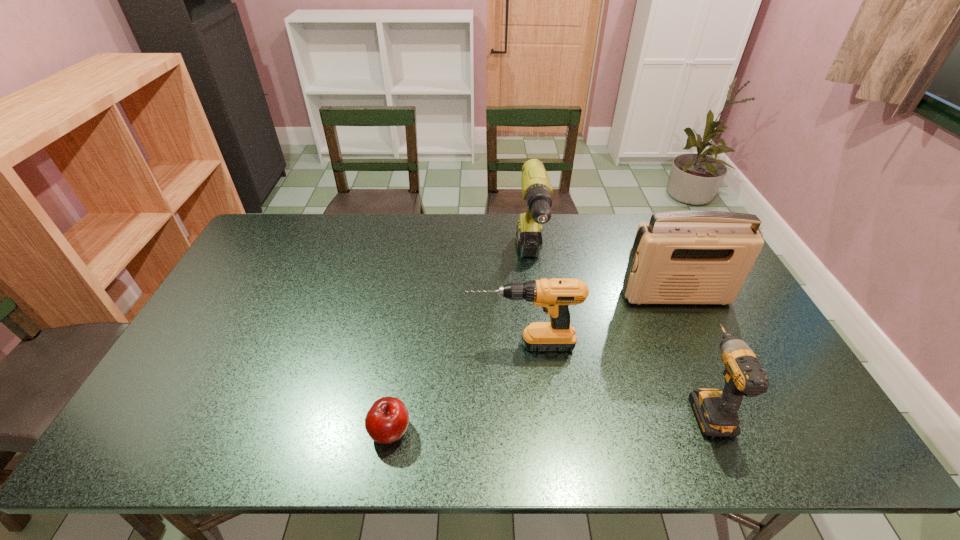
Where is `free spot that satisfies the following two spatial constraints: 1. on the handle side of the tallest drill; 2. at the tip of the third nearest object`? The height and width of the screenshot is (540, 960). free spot that satisfies the following two spatial constraints: 1. on the handle side of the tallest drill; 2. at the tip of the third nearest object is located at coordinates (541, 345).

The height and width of the screenshot is (540, 960). Identify the location of vacant space that satisfies the following two spatial constraints: 1. at the tip of the second nearest drill; 2. with the drill bit of the rightmost drill facing forward. (527, 406).

The image size is (960, 540). I want to click on vacant space that satisfies the following two spatial constraints: 1. with the drill bit of the rightmost drill facing forward; 2. at the tip of the third farthest object, so click(x=681, y=345).

Locate an element on the screen. The image size is (960, 540). free space that satisfies the following two spatial constraints: 1. on the handle side of the tallest drill; 2. at the tip of the third nearest object is located at coordinates (541, 345).